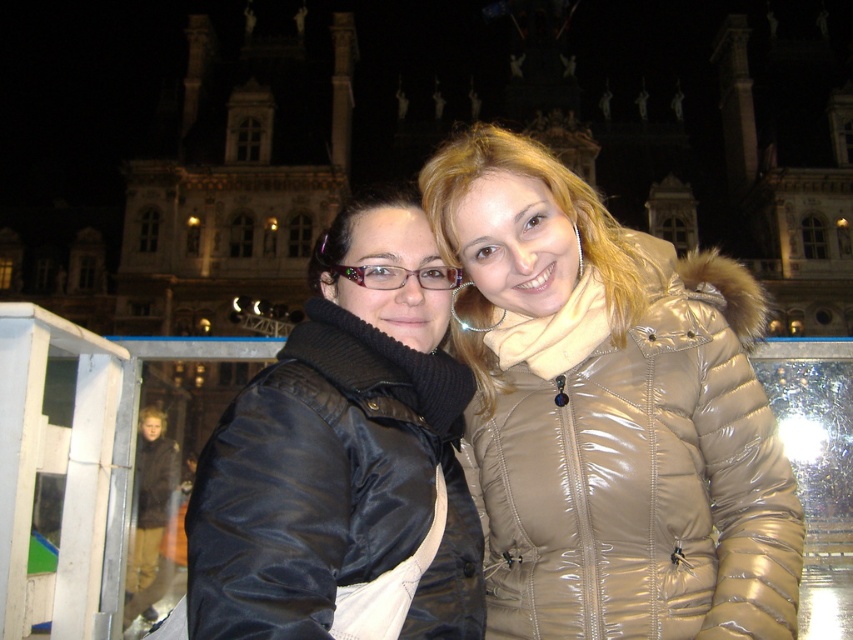
Does shiny beige coat at center have a greater height compared to black satin jacket at center?

Indeed, shiny beige coat at center has a greater height compared to black satin jacket at center.

Does shiny beige coat at center have a lesser height compared to black satin jacket at center?

No, shiny beige coat at center is not shorter than black satin jacket at center.

Between point (764, 426) and point (421, 442), which one is positioned in front?

Positioned in front is point (421, 442).

Find the location of a particular element. The height and width of the screenshot is (640, 853). shiny beige coat at center is located at coordinates (610, 413).